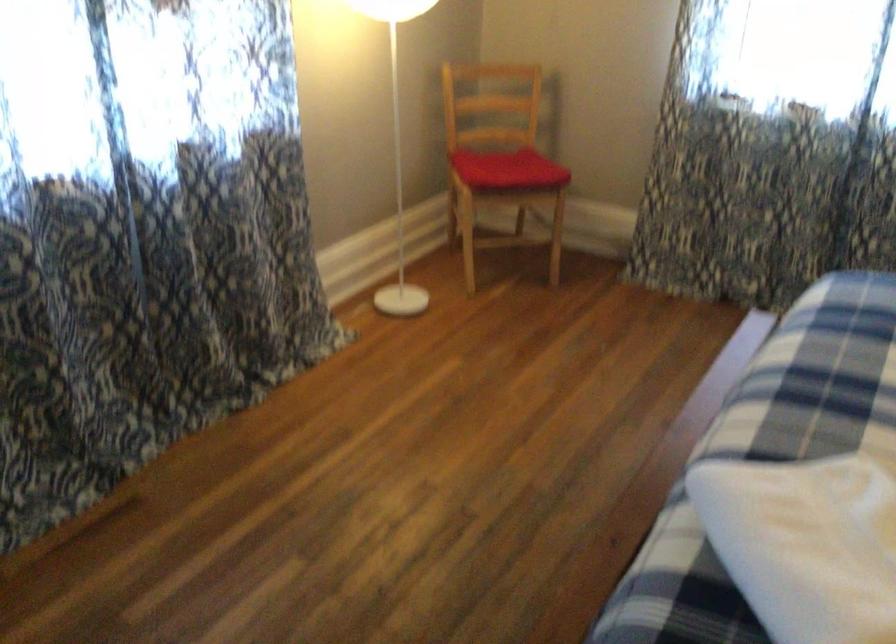
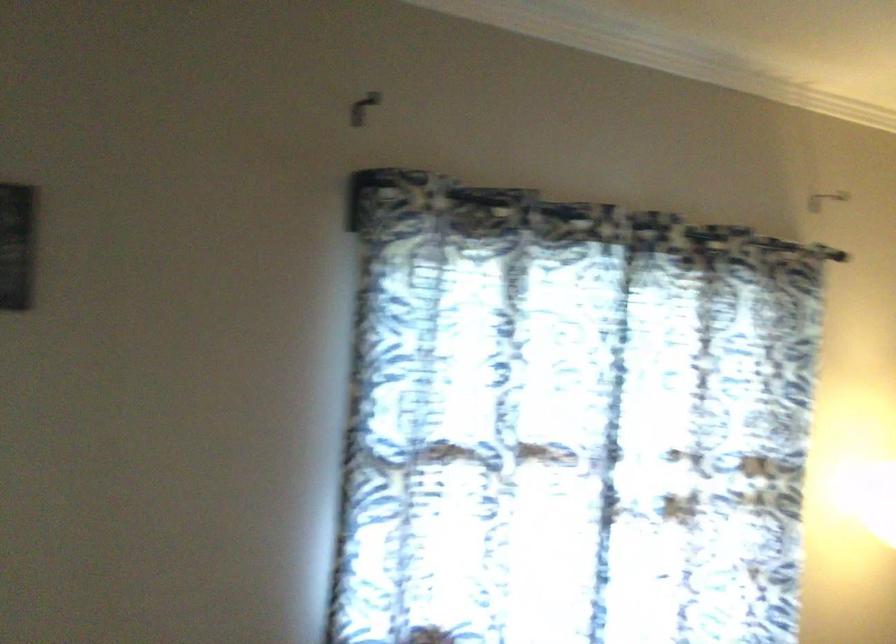
The images are taken continuously from a first-person perspective. In which direction is your viewpoint rotating?

The rotation direction of the camera is left-up.